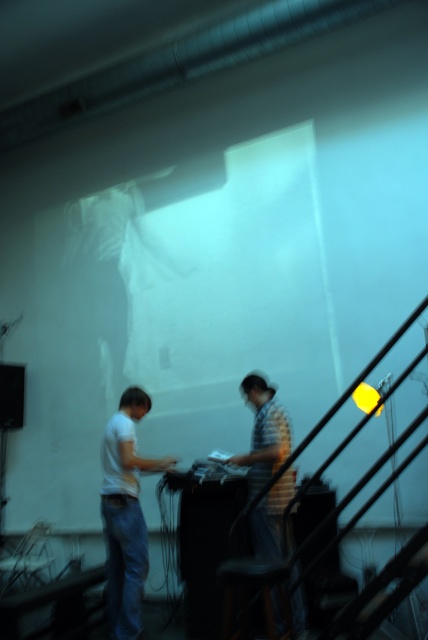
Who is shorter, white matte shirt at left or striped cotton shirt at center?

striped cotton shirt at center

Can you confirm if white matte shirt at left is bigger than striped cotton shirt at center?

Actually, white matte shirt at left might be smaller than striped cotton shirt at center.

The width and height of the screenshot is (428, 640). What are the coordinates of `white matte shirt at left` in the screenshot? It's located at (125, 513).

In order to click on white matte shirt at left in this screenshot , I will do `click(125, 513)`.

Is white matte shirt at left to the right of dark brown wooden stool at lower center from the viewer's perspective?

No, white matte shirt at left is not to the right of dark brown wooden stool at lower center.

Is white matte shirt at left below dark brown wooden stool at lower center?

No.

Which is behind, point (130, 477) or point (237, 582)?

Point (130, 477)

What are the coordinates of `white matte shirt at left` in the screenshot? It's located at (125, 513).

Can you confirm if striped cotton shirt at center is positioned below dark brown wooden stool at lower center?

No.

Is striped cotton shirt at center closer to the viewer compared to dark brown wooden stool at lower center?

No, it is not.

You are a GUI agent. You are given a task and a screenshot of the screen. Output one action in this format:
    pyautogui.click(x=<x>, y=<y>)
    Task: Click on the striped cotton shirt at center
    
    Given the screenshot: What is the action you would take?
    pyautogui.click(x=262, y=433)

You are a GUI agent. You are given a task and a screenshot of the screen. Output one action in this format:
    pyautogui.click(x=<x>, y=<y>)
    Task: Click on the striped cotton shirt at center
    
    Given the screenshot: What is the action you would take?
    pyautogui.click(x=262, y=433)